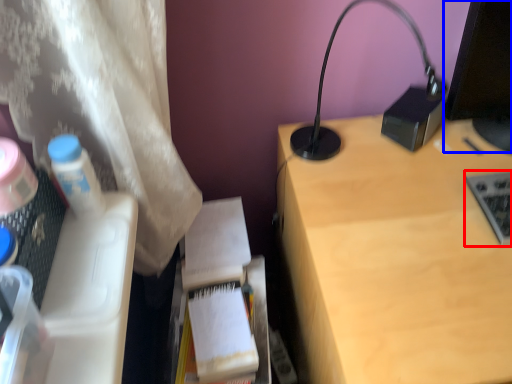
Question: Which of the following is the closest to the observer, laptop keyboard (highlighted by a red box) or computer screen (highlighted by a blue box)?

Choices:
 (A) laptop keyboard
 (B) computer screen

Answer: (B)